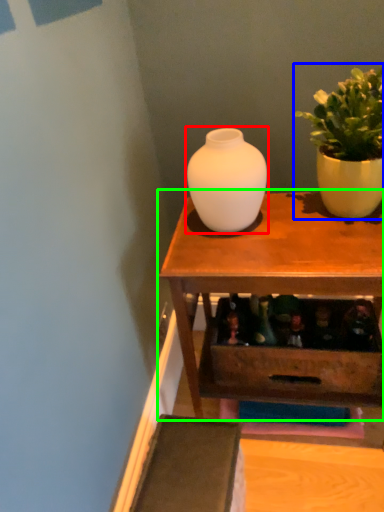
Question: Which object is positioned farthest from vase (highlighted by a red box)? Select from houseplant (highlighted by a blue box) and table (highlighted by a green box).

Choices:
 (A) houseplant
 (B) table

Answer: (A)